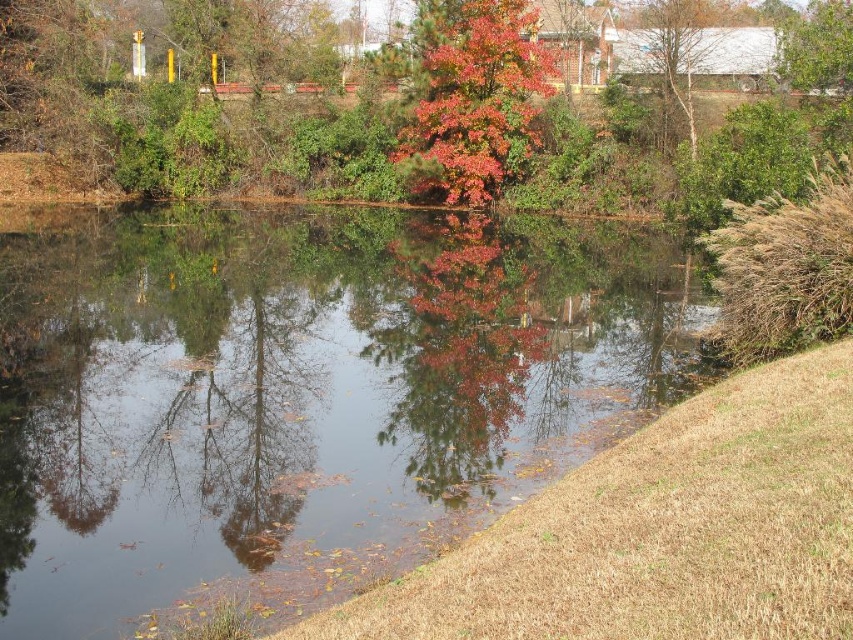
Question: Is transparent water at center to the left of bare branches at upper right from the viewer's perspective?

Choices:
 (A) yes
 (B) no

Answer: (A)

Question: Does transparent water at center have a greater width compared to autumn leaves at center?

Choices:
 (A) yes
 (B) no

Answer: (B)

Question: Which is farther from the bare branches at upper right?

Choices:
 (A) shiny red leaves at center
 (B) autumn leaves at center

Answer: (B)

Question: Is autumn leaves at center further to the viewer compared to shiny red leaves at center?

Choices:
 (A) yes
 (B) no

Answer: (B)

Question: Which object appears closest to the camera in this image?

Choices:
 (A) autumn leaves at center
 (B) transparent water at center
 (C) shiny red leaves at center

Answer: (B)

Question: Which point is farther to the camera?

Choices:
 (A) (801, 22)
 (B) (494, 145)

Answer: (B)